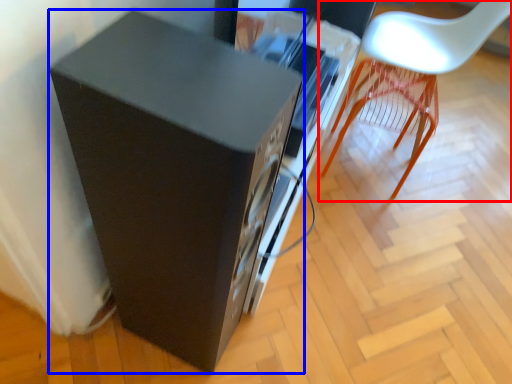
Question: Among these objects, which one is farthest to the camera, chair (highlighted by a red box) or furniture (highlighted by a blue box)?

Choices:
 (A) chair
 (B) furniture

Answer: (A)